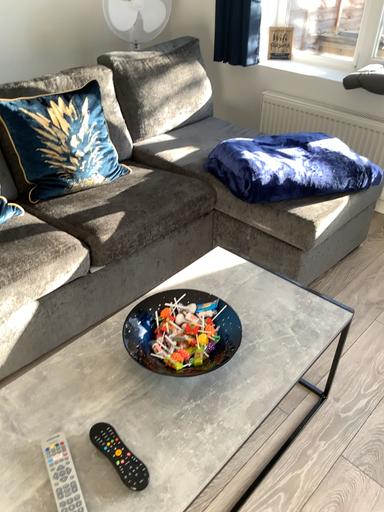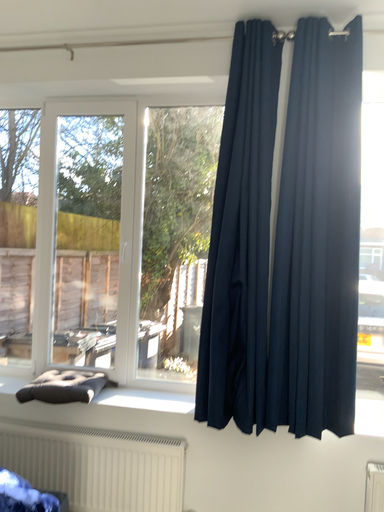
Question: Which way did the camera rotate in the video?

Choices:
 (A) rotated upward
 (B) rotated downward

Answer: (A)